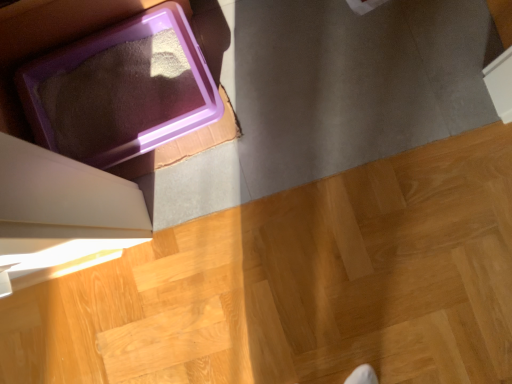
This screenshot has height=384, width=512. What do you see at coordinates (121, 90) in the screenshot? I see `purple plastic litter box at upper left` at bounding box center [121, 90].

The width and height of the screenshot is (512, 384). I want to click on purple plastic litter box at upper left, so pyautogui.click(x=121, y=90).

Identify the location of purple plastic litter box at upper left. This screenshot has height=384, width=512. (121, 90).